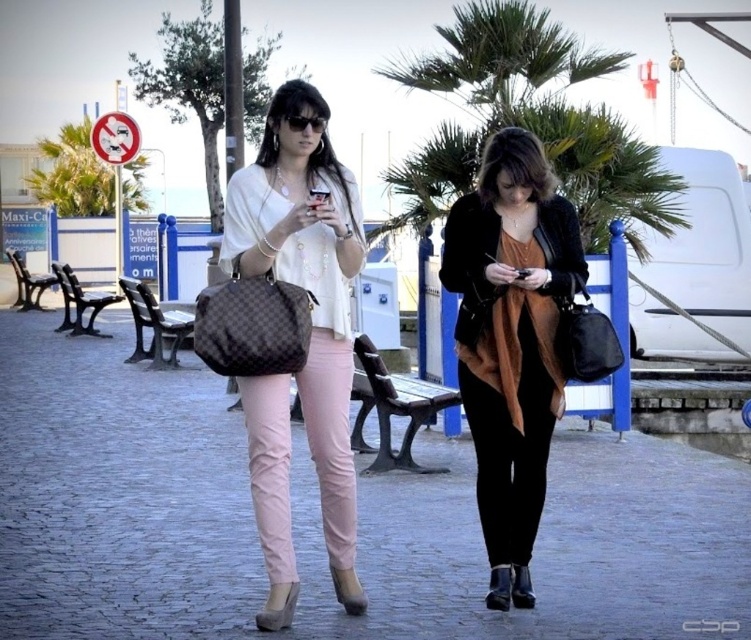
Question: Which of the following is the closest to the observer?

Choices:
 (A) matte black handbag at center
 (B) matte black smartphone at center
 (C) green leafy palm tree at upper left
 (D) black glossy smartphone at center

Answer: (A)

Question: Does green leafy palm tree at upper center have a greater width compared to green leafy palm tree at upper left?

Choices:
 (A) yes
 (B) no

Answer: (A)

Question: Which object is the farthest from the matte black jacket at center?

Choices:
 (A) matte pink pants at center
 (B) green leafy palm tree at upper center
 (C) black glossy smartphone at center
 (D) matte black smartphone at center

Answer: (B)

Question: Can you confirm if matte black handbag at center is smaller than matte black smartphone at center?

Choices:
 (A) no
 (B) yes

Answer: (A)

Question: Does matte pink pants at center appear on the left side of matte black handbag at center?

Choices:
 (A) yes
 (B) no

Answer: (B)

Question: Which of these objects is positioned farthest from the matte black handbag at center?

Choices:
 (A) matte black jacket at center
 (B) matte black smartphone at center

Answer: (A)